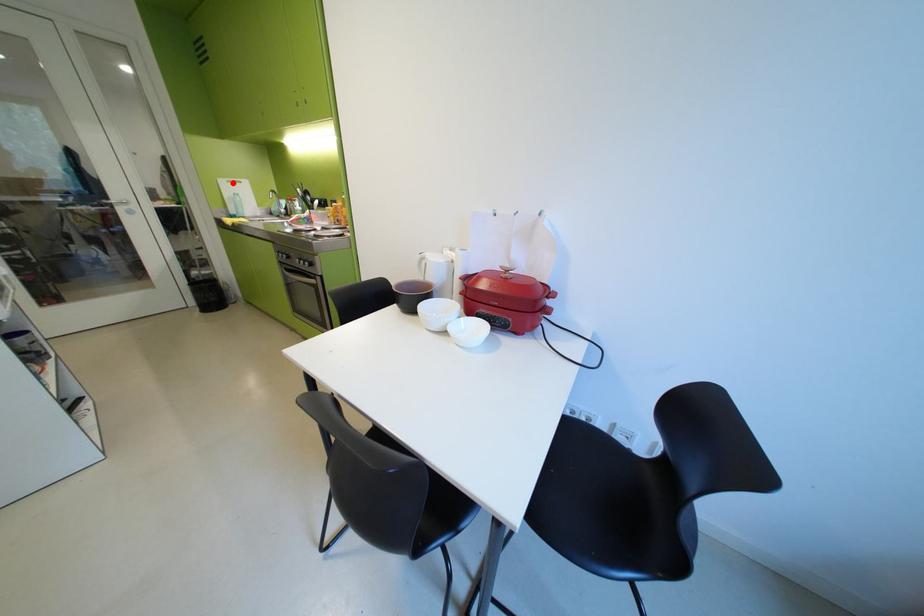
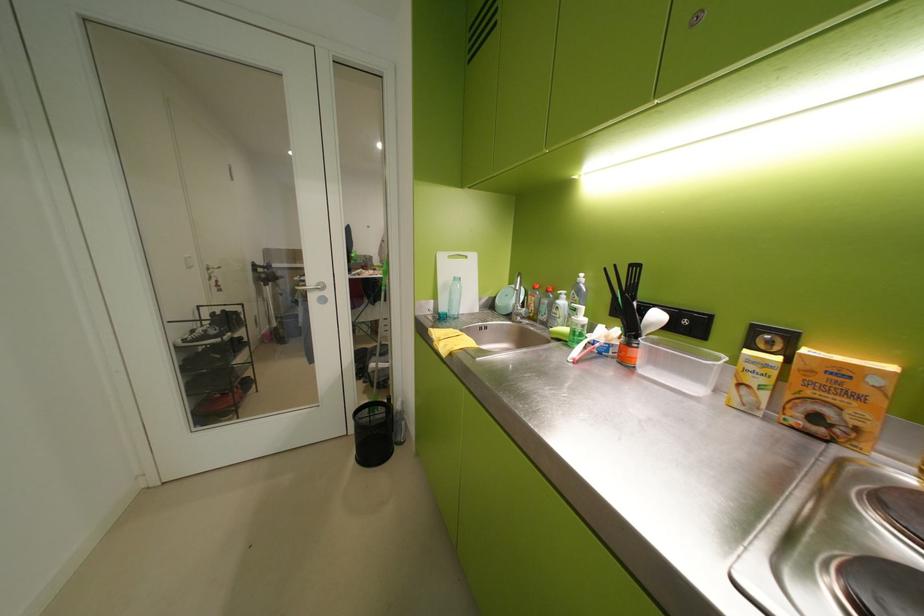
The point at the highlighted location is marked in the first image. Where is the corresponding point in the second image?

(453, 259)